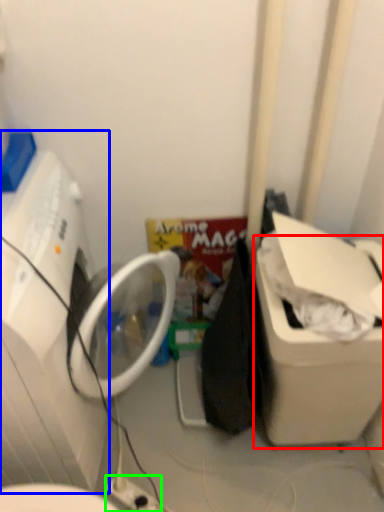
Question: Based on their relative distances, which object is nearer to water cooler (highlighted by a red box)? Choose from washing machine (highlighted by a blue box) and electric outlet (highlighted by a green box).

Choices:
 (A) washing machine
 (B) electric outlet

Answer: (B)